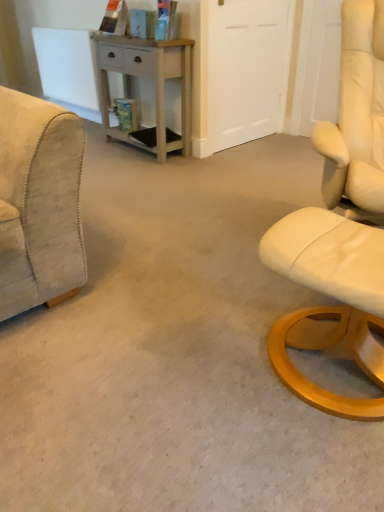
Describe the element at coordinates (39, 203) in the screenshot. I see `beige corduroy armchair at left` at that location.

Locate an element on the screen. This screenshot has width=384, height=512. light gray wood desk at center is located at coordinates (149, 79).

Which of these two, light gray wood desk at center or white matte door at upper center, is bigger?

light gray wood desk at center.

Is light gray wood desk at center facing towards white matte door at upper center?

No, light gray wood desk at center is not turned towards white matte door at upper center.

Image resolution: width=384 pixels, height=512 pixels. Find the location of `desk that is in front of the white matte door at upper center`. desk that is in front of the white matte door at upper center is located at coordinates (149, 79).

Considering the sizes of light gray wood desk at center and white matte door at upper center in the image, is light gray wood desk at center taller or shorter than white matte door at upper center?

light gray wood desk at center is shorter than white matte door at upper center.

At what (x,y) coordinates should I click in order to perform the action: click on glass door lying on the right of beige corduroy armchair at left. Please return your answer as a coordinate pair (x, y). The width and height of the screenshot is (384, 512). Looking at the image, I should click on (246, 70).

What's the angular difference between beige corduroy armchair at left and white matte door at upper center's facing directions?

The facing directions of beige corduroy armchair at left and white matte door at upper center are 49.3 degrees apart.

Is beige corduroy armchair at left situated inside white matte door at upper center or outside?

beige corduroy armchair at left lies outside white matte door at upper center.

Can you confirm if beige corduroy armchair at left is smaller than white matte door at upper center?

No.

Based on the photo, between beige corduroy armchair at left and light gray wood desk at center, which one is positioned behind?

light gray wood desk at center is behind.

Is beige corduroy armchair at left oriented towards light gray wood desk at center?

No, beige corduroy armchair at left is not oriented towards light gray wood desk at center.

Considering the relative positions of beige corduroy armchair at left and light gray wood desk at center in the image provided, is beige corduroy armchair at left to the left or to the right of light gray wood desk at center?

Clearly, beige corduroy armchair at left is on the left of light gray wood desk at center in the image.

What's the angular difference between beige corduroy armchair at left and light gray wood desk at center's facing directions?

There is a 41.2-degree angle between the facing directions of beige corduroy armchair at left and light gray wood desk at center.

From the image's perspective, which object appears higher, white matte door at upper center or light gray wood desk at center?

From the image's view, white matte door at upper center is above.

Considering the positions of points (266, 44) and (157, 117), is point (266, 44) closer to camera compared to point (157, 117)?

No, it is not.

Which object is wider, white matte door at upper center or light gray wood desk at center?

light gray wood desk at center.

Between white matte door at upper center and light gray wood desk at center, which one has more height?

white matte door at upper center.

How far apart are white matte door at upper center and beige corduroy armchair at left?

white matte door at upper center is 6.28 feet from beige corduroy armchair at left.

From the image's perspective, is white matte door at upper center over beige corduroy armchair at left?

Correct, white matte door at upper center appears higher than beige corduroy armchair at left in the image.

Based on the photo, is white matte door at upper center positioned beyond the bounds of beige corduroy armchair at left?

Yes.

Does white matte door at upper center have a larger size compared to beige corduroy armchair at left?

Actually, white matte door at upper center might be smaller than beige corduroy armchair at left.

From a real-world perspective, is light gray wood desk at center physically above beige corduroy armchair at left?

Actually, light gray wood desk at center is physically below beige corduroy armchair at left in the real world.

Could beige corduroy armchair at left be considered to be inside light gray wood desk at center?

Definitely not — beige corduroy armchair at left is not inside light gray wood desk at center.

Considering the points (101, 100) and (8, 270), which point is in front, point (101, 100) or point (8, 270)?

Positioned in front is point (8, 270).

How many degrees apart are the facing directions of light gray wood desk at center and beige corduroy armchair at left?

The facing directions of light gray wood desk at center and beige corduroy armchair at left are 41.2 degrees apart.

Identify the location of desk in front of the white matte door at upper center. Image resolution: width=384 pixels, height=512 pixels. pos(149,79).

At what (x,y) coordinates should I click in order to perform the action: click on glass door directly beneath the beige corduroy armchair at left (from a real-world perspective). Please return your answer as a coordinate pair (x, y). This screenshot has height=512, width=384. Looking at the image, I should click on (246, 70).

Looking at the image, which one is located closer to beige corduroy armchair at left, white matte door at upper center or light gray wood desk at center?

light gray wood desk at center lies closer to beige corduroy armchair at left than the other object.

Based on their spatial positions, is light gray wood desk at center or beige corduroy armchair at left further from white matte door at upper center?

beige corduroy armchair at left.

Looking at the image, which one is located closer to light gray wood desk at center, beige corduroy armchair at left or white matte door at upper center?

white matte door at upper center.

Estimate the real-world distances between objects in this image. Which object is further from white matte door at upper center, beige corduroy armchair at left or light gray wood desk at center?

beige corduroy armchair at left lies further to white matte door at upper center than the other object.

When comparing their distances from light gray wood desk at center, does white matte door at upper center or beige corduroy armchair at left seem further?

The object further to light gray wood desk at center is beige corduroy armchair at left.

Considering their positions, is light gray wood desk at center positioned closer to beige corduroy armchair at left than white matte door at upper center?

light gray wood desk at center is positioned closer to the anchor beige corduroy armchair at left.

Where is `desk positioned between beige corduroy armchair at left and white matte door at upper center from near to far`? This screenshot has height=512, width=384. desk positioned between beige corduroy armchair at left and white matte door at upper center from near to far is located at coordinates (149, 79).